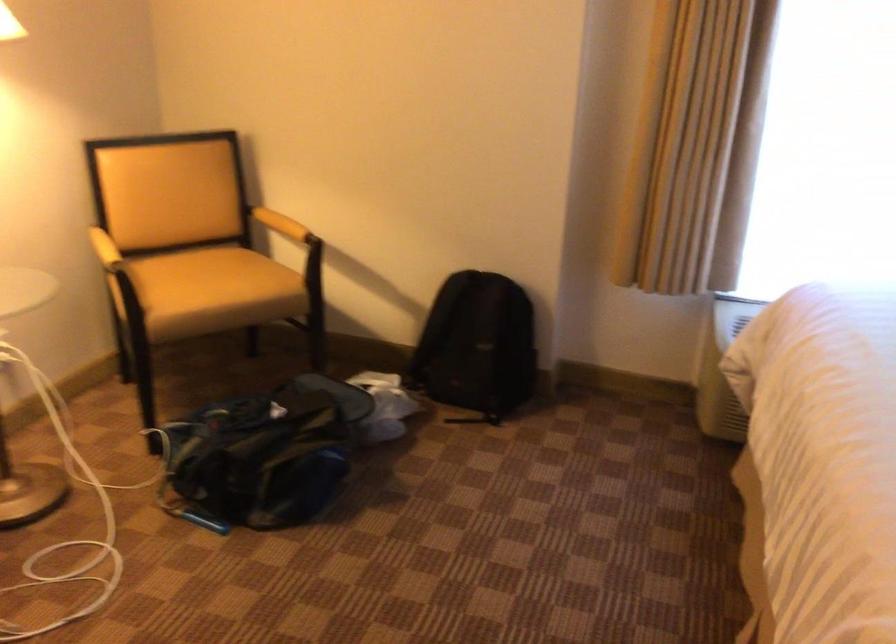
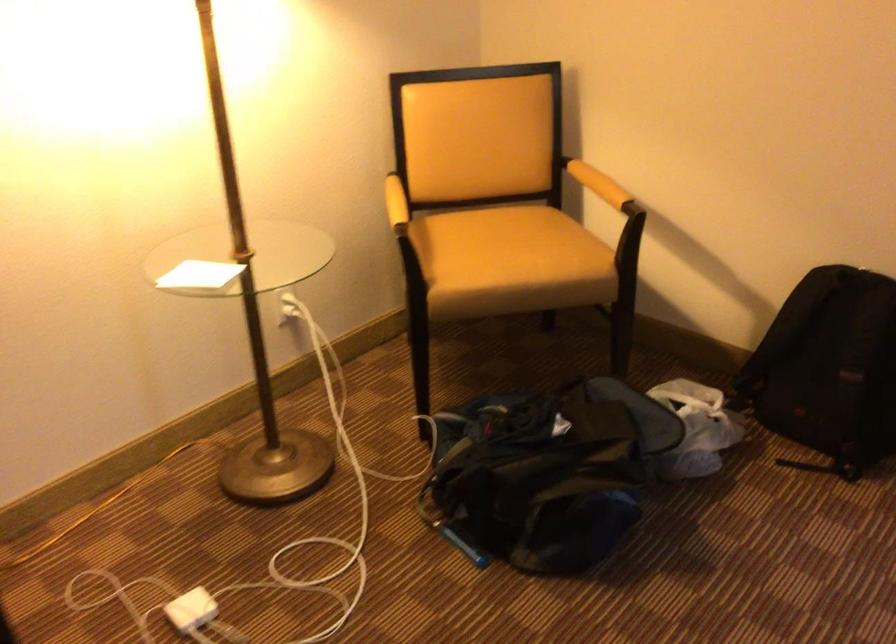
The point at (383,404) is marked in the first image. Where is the corresponding point in the second image?

(696, 428)